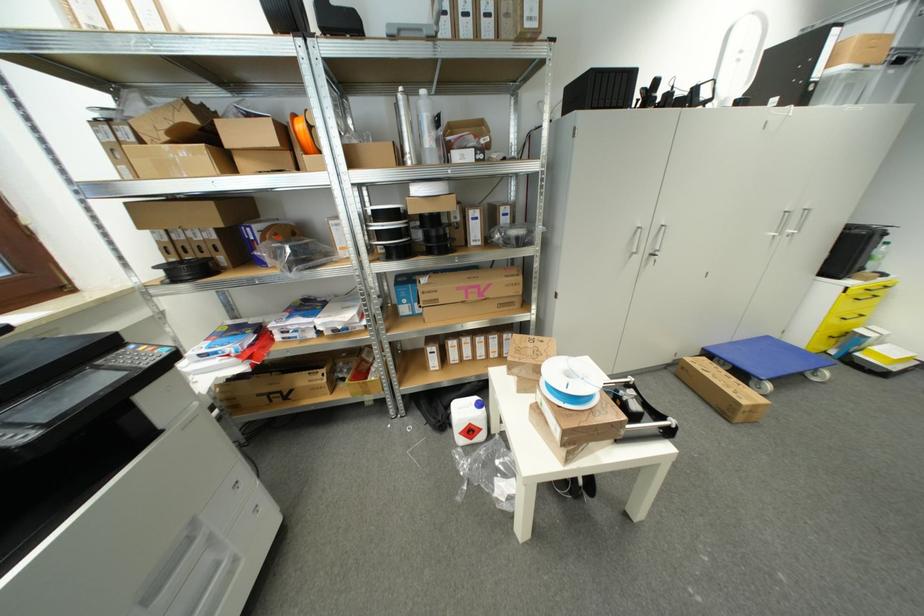
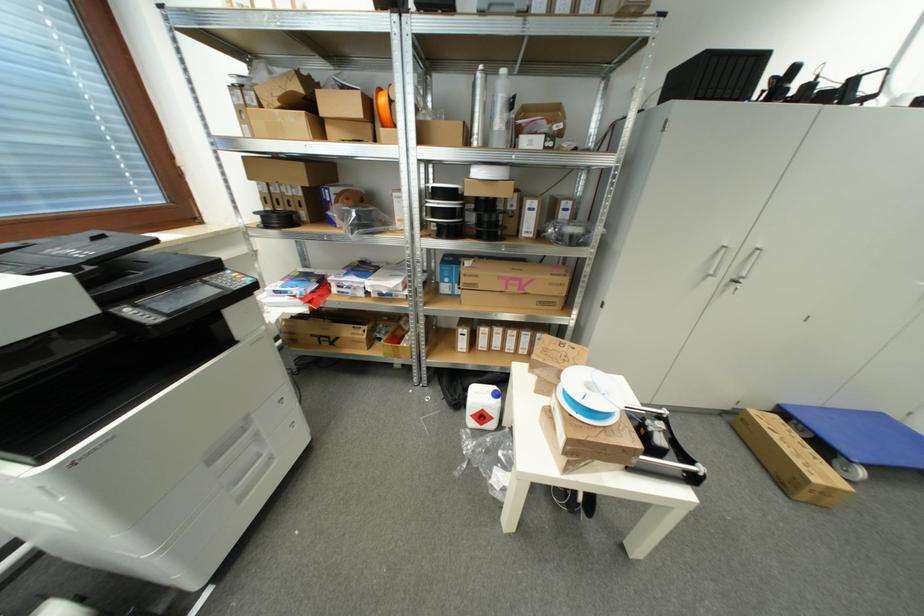
Where in the second image is the point corresponding to [193,272] from the first image?

(283, 222)